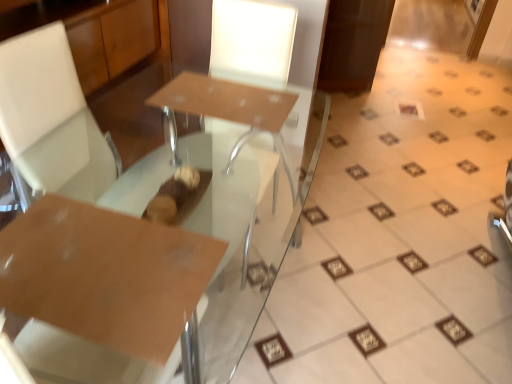
Measure the distance between point [56,299] and camera.

Point [56,299] is 29.76 inches away from camera.

Identify the location of matte brown table at center. Image resolution: width=512 pixels, height=384 pixels. (231, 109).

How different are the orientations of white glossy frame at upper right and matte brown table at center in degrees?

173 degrees separate the facing orientations of white glossy frame at upper right and matte brown table at center.

From a real-world perspective, which is physically below, white glossy frame at upper right or matte brown table at center?

In real-world perspective, white glossy frame at upper right is lower.

Which object is positioned more to the right, white glossy frame at upper right or matte brown table at center?

From the viewer's perspective, white glossy frame at upper right appears more on the right side.

Which of these two, matte brown table at center or glossy brown table at center, is bigger?

Bigger between the two is matte brown table at center.

Is the depth of matte brown table at center greater than that of glossy brown table at center?

Yes.

Would you say matte brown table at center is outside glossy brown table at center?

Yes, matte brown table at center is outside of glossy brown table at center.

Is glossy brown table at center at the back of matte brown table at center?

Correct, matte brown table at center is looking away from glossy brown table at center.

Can matte brown table at center be found inside glossy brown table at center?

No.

Based on the photo, from the image's perspective, does glossy brown table at center appear higher than matte brown table at center?

No.

Which of these two, glossy brown table at center or matte brown table at center, stands taller?

With more height is matte brown table at center.

Could you tell me if glossy brown table at center is facing matte brown table at center?

No, glossy brown table at center is not oriented towards matte brown table at center.

Does glossy brown table at center have a larger size compared to white glossy frame at upper right?

Yes.

Considering the points (34, 266) and (399, 104), which point is in front, point (34, 266) or point (399, 104)?

The point (34, 266) is closer.

In order to click on table above the white glossy frame at upper right (from a real-world perspective) in this screenshot , I will do `click(105, 275)`.

From the image's perspective, is glossy brown table at center on top of white glossy frame at upper right?

Incorrect, from the image's perspective, glossy brown table at center is lower than white glossy frame at upper right.

How many degrees apart are the facing directions of white glossy frame at upper right and glossy brown table at center?

The angular difference between white glossy frame at upper right and glossy brown table at center is 82.8 degrees.

I want to click on table on the left of white glossy frame at upper right, so click(105, 275).

Can we say white glossy frame at upper right lies outside glossy brown table at center?

white glossy frame at upper right lies outside glossy brown table at center's area.

Is white glossy frame at upper right wider than glossy brown table at center?

Incorrect, the width of white glossy frame at upper right does not surpass that of glossy brown table at center.

Which object is more forward, matte brown table at center or white glossy frame at upper right?

matte brown table at center is closer to the camera.

Identify the location of round table in front of the white glossy frame at upper right. The height and width of the screenshot is (384, 512). (231, 109).

Can you confirm if matte brown table at center is thinner than white glossy frame at upper right?

Incorrect, the width of matte brown table at center is not less than that of white glossy frame at upper right.

Find the location of `square lying above the matte brown table at center (from the image's perspective)`. square lying above the matte brown table at center (from the image's perspective) is located at coordinates (410, 109).

Identify the location of table in front of the matte brown table at center. (105, 275).

When comparing their distances from matte brown table at center, does white glossy frame at upper right or glossy brown table at center seem closer?

glossy brown table at center is closer to matte brown table at center.

When comparing their distances from matte brown table at center, does glossy brown table at center or white glossy frame at upper right seem closer?

The object closer to matte brown table at center is glossy brown table at center.

When comparing their distances from white glossy frame at upper right, does matte brown table at center or glossy brown table at center seem closer?

matte brown table at center lies closer to white glossy frame at upper right than the other object.

Which object lies nearer to the anchor point glossy brown table at center, matte brown table at center or white glossy frame at upper right?

matte brown table at center lies closer to glossy brown table at center than the other object.

From the image, which object appears to be nearer to glossy brown table at center, white glossy frame at upper right or matte brown table at center?

matte brown table at center is closer to glossy brown table at center.

Which object lies further to the anchor point white glossy frame at upper right, glossy brown table at center or matte brown table at center?

The object further to white glossy frame at upper right is glossy brown table at center.

What are the coordinates of `round table between glossy brown table at center and white glossy frame at upper right from front to back` in the screenshot? It's located at (231, 109).